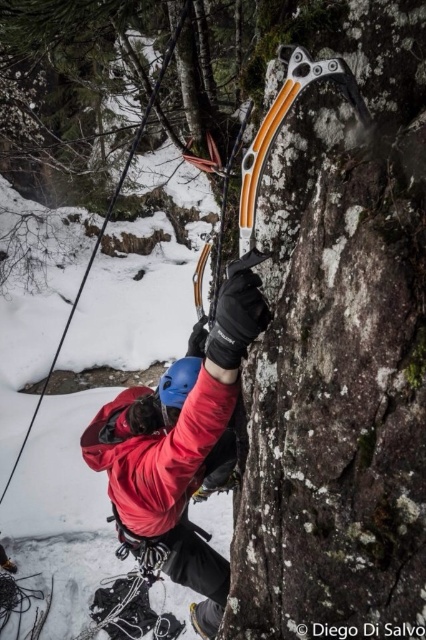
Who is shorter, matte red jacket at center or orange plastic ice axe at upper center?

orange plastic ice axe at upper center is shorter.

Does matte red jacket at center have a greater height compared to orange plastic ice axe at upper center?

Yes.

Image resolution: width=426 pixels, height=640 pixels. I want to click on matte red jacket at center, so click(x=181, y=440).

Where is `matte red jacket at center`? The width and height of the screenshot is (426, 640). matte red jacket at center is located at coordinates (181, 440).